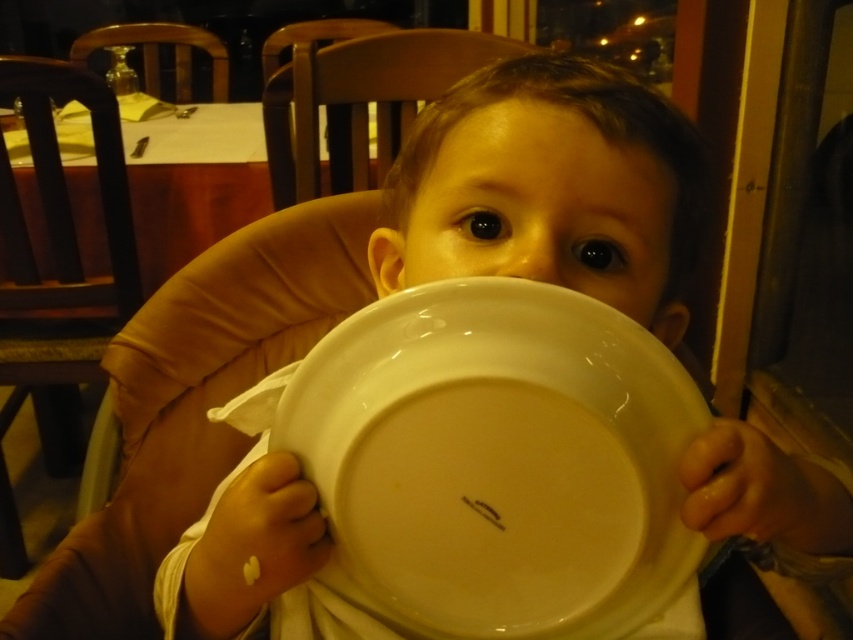
You are a parent trying to find a seat for your child in a restaurant. You see the wooden chair at left and the wooden chair at upper center. Can you bring your child to sit between these two chairs?

The distance between the wooden chair at left and the wooden chair at upper center is 1.32 meters, so yes, you can bring your child to sit between them as there is enough space.

You are a waiter in a restaurant and need to place a drink on the table. The table has a white glossy platter at center. Where should you place the drink to ensure it is not covered by the platter?

The white glossy platter at center is located at point (497, 461), so you should place the drink in an area not overlapping with the platter, such as near the edges of the table away from its position.

You are a photographer trying to capture the child without any obstructions. There is a wooden chair at left located at point (64, 202). Is the wooden chair at left blocking the view of the child?

The wooden chair at left located at point (64, 202) is part of the background and does not block the view of the child since the child is seated in front of it.